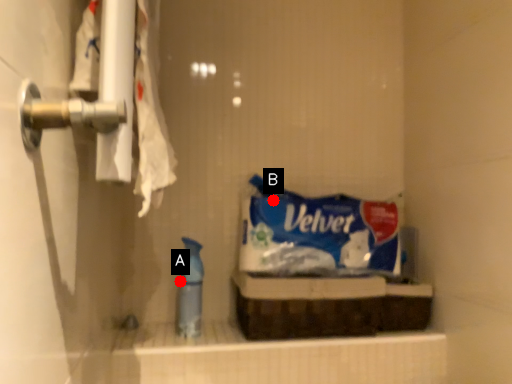
Question: Two points are circled on the image, labeled by A and B beside each circle. Among these points, which one is nearest to the camera?

Choices:
 (A) A is closer
 (B) B is closer

Answer: (A)